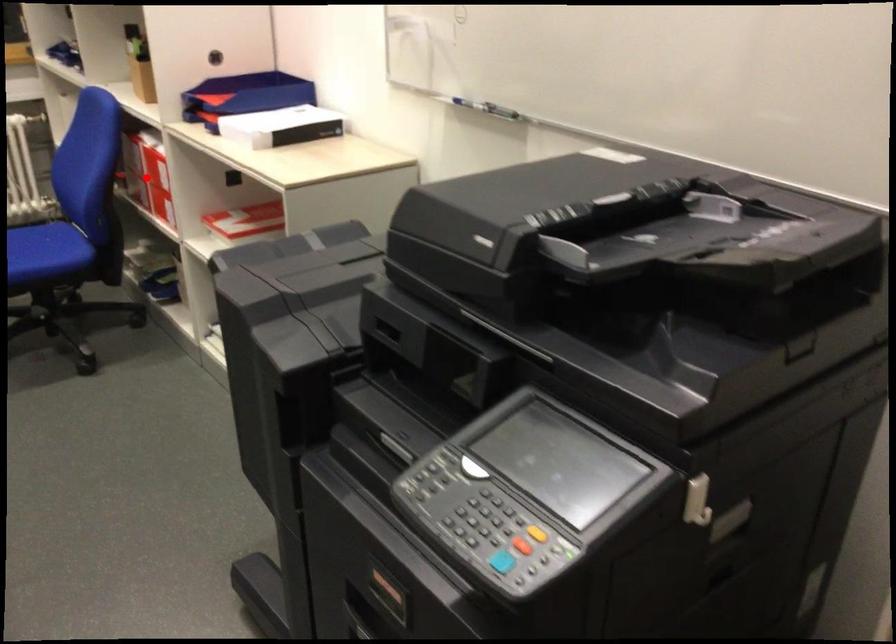
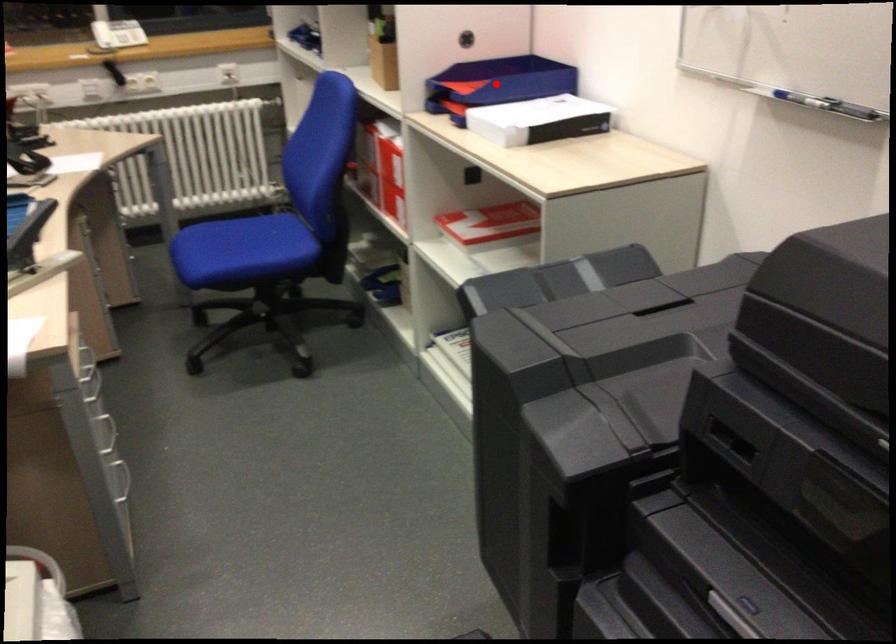
I am providing you with two images of the same scene from different viewpoints. A red point is marked on the first image and another point is marked on the second image. Is the marked point in image1 the same physical position as the marked point in image2?

No